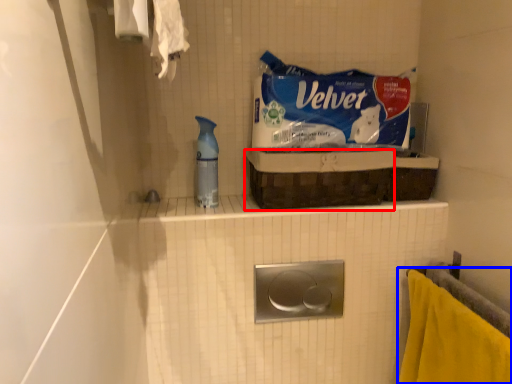
Question: Which object appears closest to the camera in this image, basket (highlighted by a red box) or towel (highlighted by a blue box)?

Choices:
 (A) basket
 (B) towel

Answer: (B)